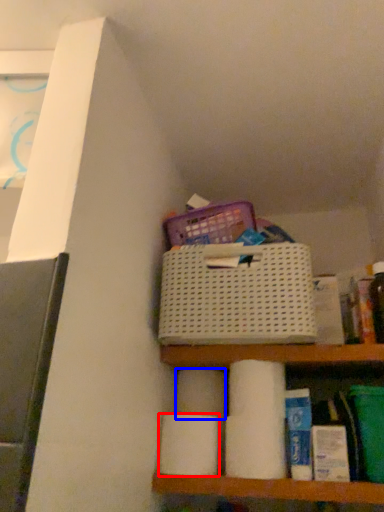
Question: Which object is closer to the camera taking this photo, toilet paper (highlighted by a red box) or toilet paper (highlighted by a blue box)?

Choices:
 (A) toilet paper
 (B) toilet paper

Answer: (A)